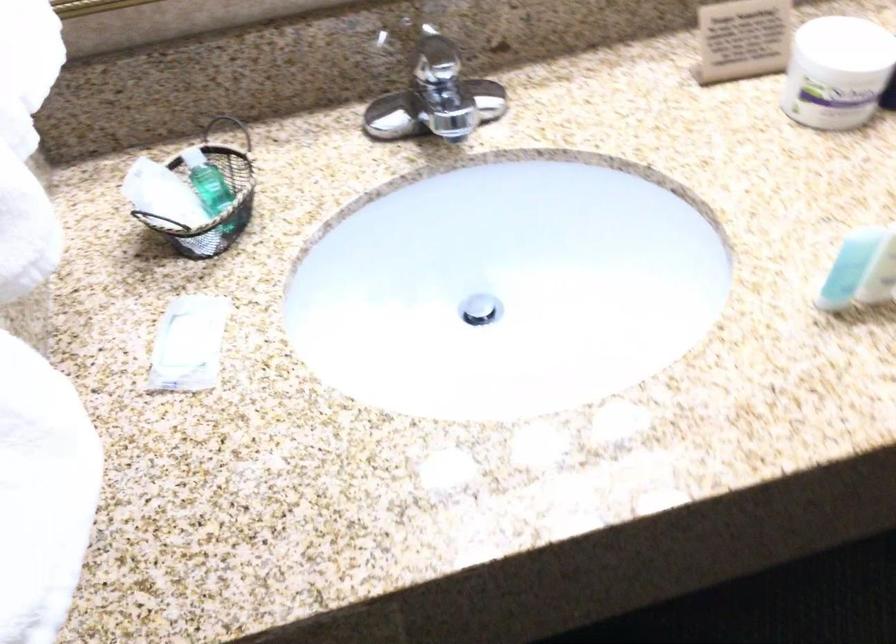
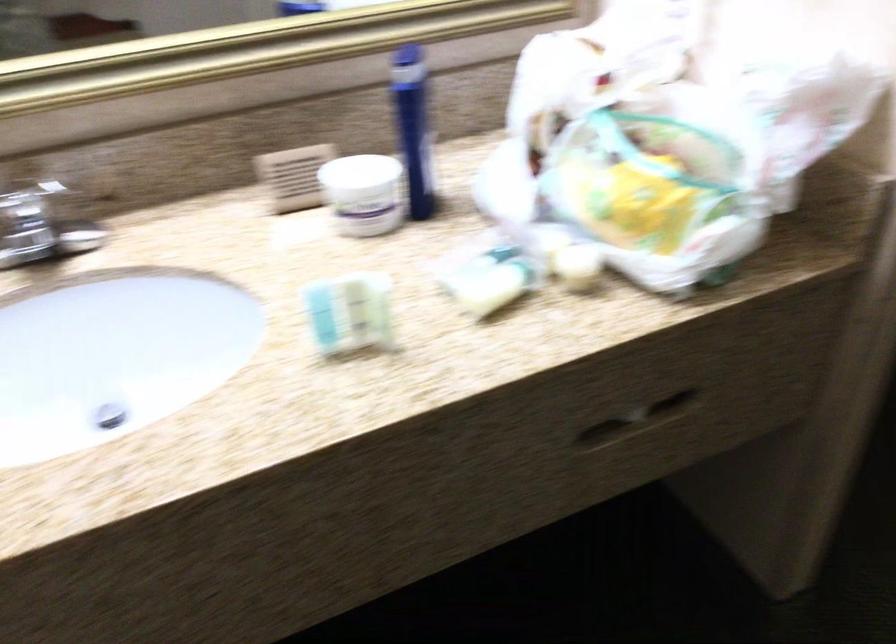
The images are taken continuously from a first-person perspective. In which direction are you moving?

The cameraman moved toward right, backward.